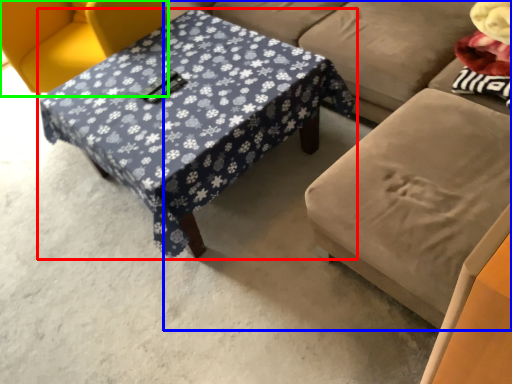
Question: Estimate the real-world distances between objects in this image. Which object is closer to table (highlighted by a red box), studio couch (highlighted by a blue box) or chair (highlighted by a green box)?

Choices:
 (A) studio couch
 (B) chair

Answer: (A)